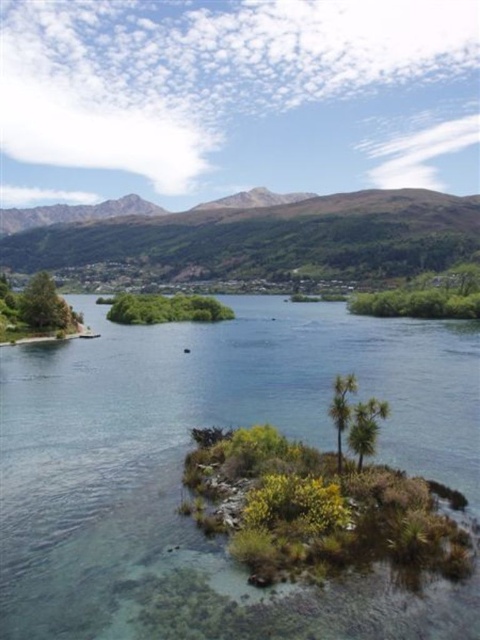
Locate an element on the screen. green forested mountain at upper center is located at coordinates tap(263, 241).

Who is more distant from viewer, (149, 268) or (362, 410)?

Point (149, 268)

Find the location of a particular element. Image resolution: width=480 pixels, height=640 pixels. green forested mountain at upper center is located at coordinates (263, 241).

Is clear water at center taller than green leafy palm tree at center?

Correct, clear water at center is much taller as green leafy palm tree at center.

Is clear water at center positioned in front of green leafy palm tree at center?

Yes, it is in front of green leafy palm tree at center.

Between point (48, 552) and point (354, 385), which one is positioned in front?

Point (48, 552) is in front.

The image size is (480, 640). I want to click on clear water at center, so click(181, 465).

Which is behind, point (193, 236) or point (342, 424)?

The point (193, 236) is behind.

Is green forested mountain at upper center taller than green leafy palm tree at center?

Correct, green forested mountain at upper center is much taller as green leafy palm tree at center.

Does point (380, 205) come closer to viewer compared to point (330, 406)?

No, (380, 205) is behind (330, 406).

This screenshot has height=640, width=480. What are the coordinates of `green forested mountain at upper center` in the screenshot? It's located at (263, 241).